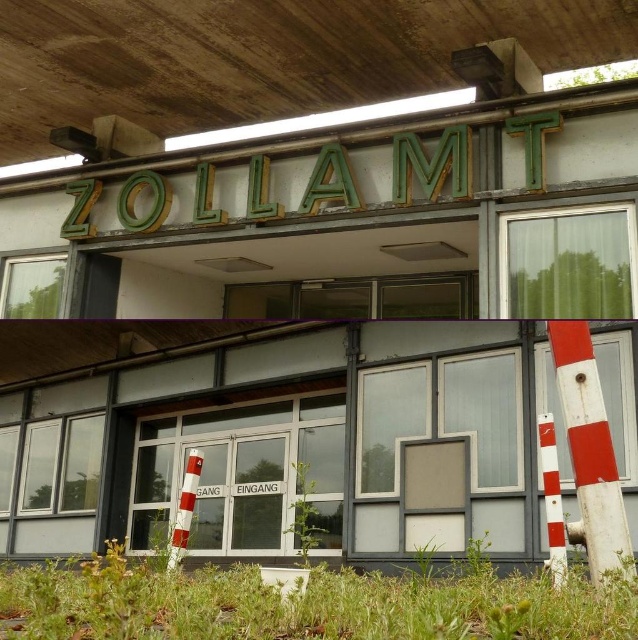
Question: Is transparent glass door at center thinner than white striped cone at center?

Choices:
 (A) yes
 (B) no

Answer: (B)

Question: Which object appears farthest from the camera in this image?

Choices:
 (A) transparent glass door at center
 (B) white striped cone at lower right
 (C) white striped cone at center

Answer: (C)

Question: Which point appears closest to the camera in this image?

Choices:
 (A) (554, 524)
 (B) (302, 406)

Answer: (A)

Question: Which of the following is the closest to the observer?

Choices:
 (A) transparent glass door at center
 (B) white striped cone at center

Answer: (A)

Question: Is white striped cone at lower right thinner than white striped cone at center?

Choices:
 (A) no
 (B) yes

Answer: (A)

Question: Can you confirm if transparent glass door at center is positioned below white striped cone at center?

Choices:
 (A) yes
 (B) no

Answer: (B)